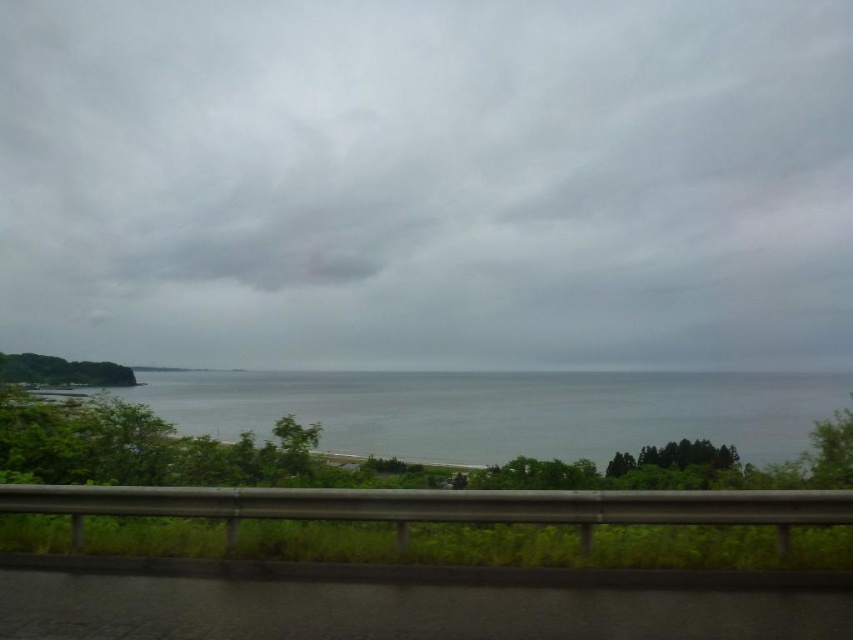
You are a photographer planning to capture the entire scene in one shot. Given that your camera can only focus on one main subject at a time, which object between the gray cloudy sky at upper center and the gray water at center would you prioritize to ensure it fills more of your photo?

The gray cloudy sky at upper center is bigger than the gray water at center, so prioritizing the gray cloudy sky at upper center would ensure it fills more of the photo.

Based on the scene described, where is the gray cloudy sky at upper center located in terms of coordinates?

The gray cloudy sky at upper center is located at coordinates point (428,182).

You are standing on the road and looking at the scene. There is a point marked at coordinates point (428,182). Based on the scene description, what object or feature does this point most likely represent?

The point (428,182) corresponds to the gray cloudy sky at upper center.